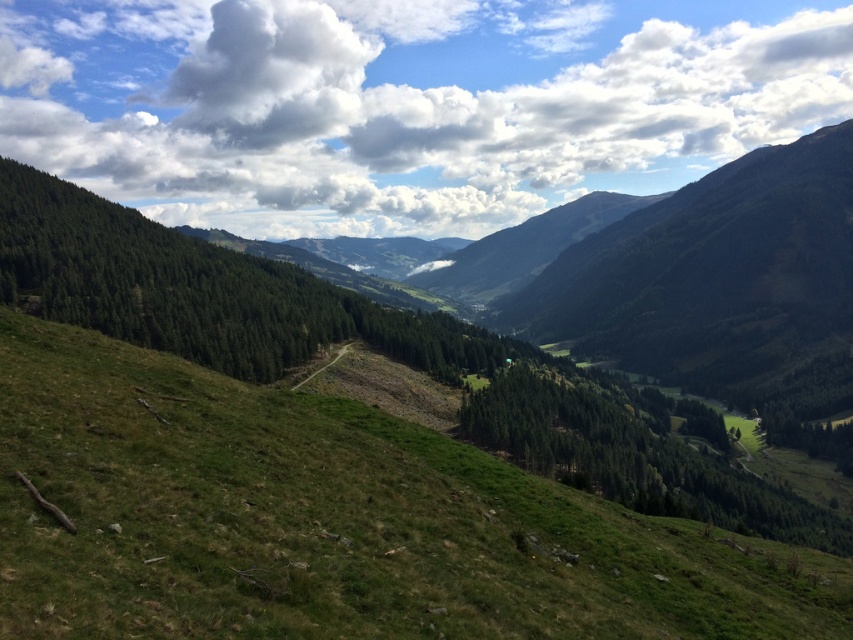
Question: Among these objects, which one is farthest from the camera?

Choices:
 (A) white fluffy cloud at upper center
 (B) green grassy slope at lower left

Answer: (A)

Question: Which object is farther from the camera taking this photo?

Choices:
 (A) green grassy slope at lower left
 (B) white fluffy cloud at upper center

Answer: (B)

Question: Is green grassy slope at lower left to the left of white fluffy cloud at upper center from the viewer's perspective?

Choices:
 (A) no
 (B) yes

Answer: (A)

Question: Can you confirm if green grassy slope at lower left is positioned to the left of white fluffy cloud at upper center?

Choices:
 (A) no
 (B) yes

Answer: (A)

Question: Is green grassy slope at lower left bigger than white fluffy cloud at upper center?

Choices:
 (A) no
 (B) yes

Answer: (A)